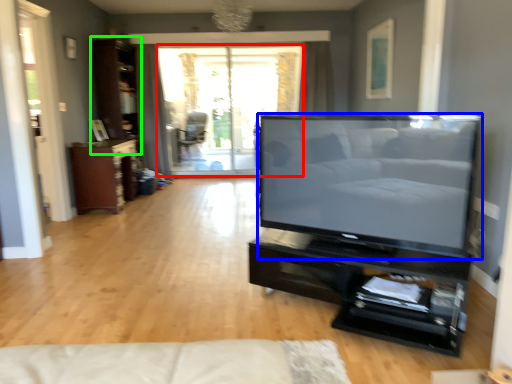
Question: Based on their relative distances, which object is nearer to window screen (highlighted by a red box)? Choose from television (highlighted by a blue box) and dresser (highlighted by a green box).

Choices:
 (A) television
 (B) dresser

Answer: (B)